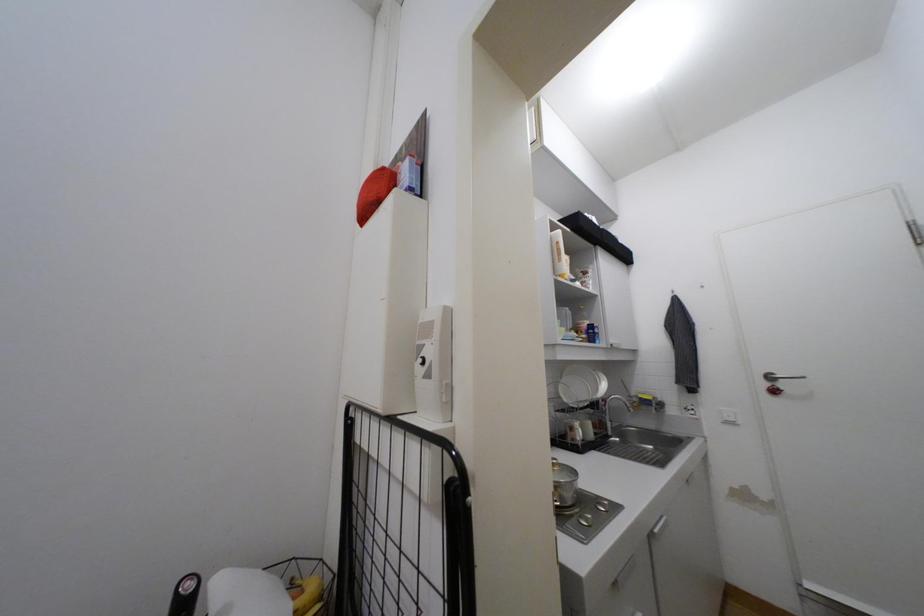
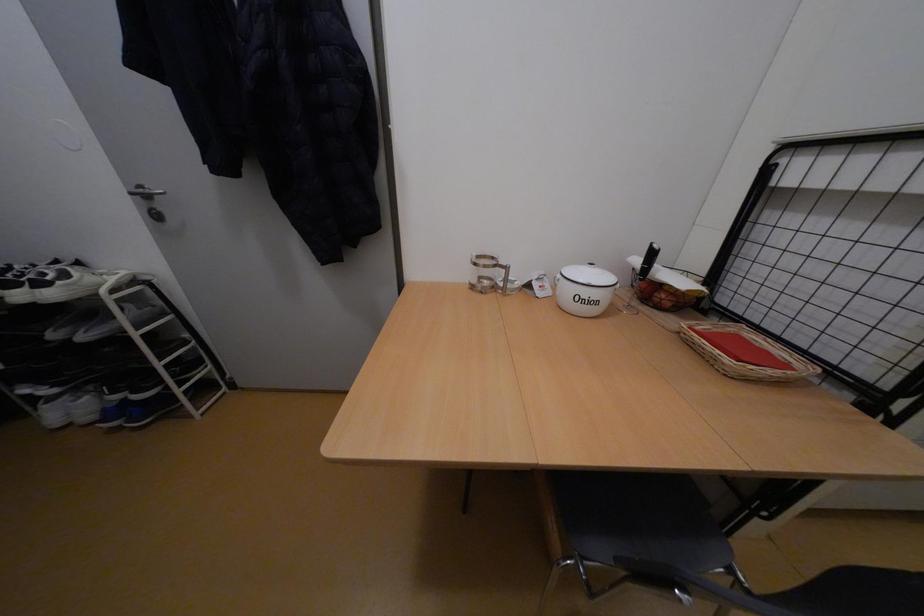
How did the camera likely rotate?

The camera rotated toward left-down.